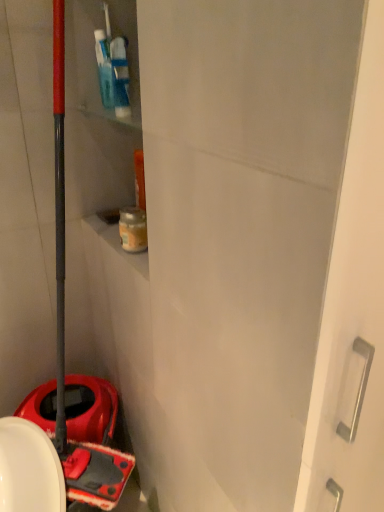
Question: Should I look upward or downward to see blue plastic shelf at upper left?

Choices:
 (A) down
 (B) up

Answer: (B)